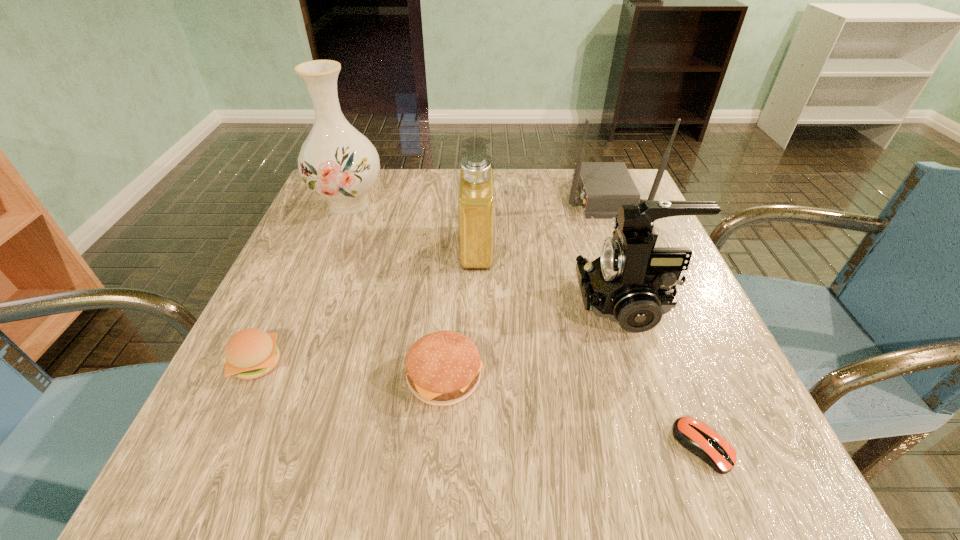
You are a GUI agent. You are given a task and a screenshot of the screen. Output one action in this format:
    pyautogui.click(x=<x>, y=<y>)
    Task: Click on the free space at the far edge of the desktop
    The image size is (960, 540).
    Given the screenshot: What is the action you would take?
    pyautogui.click(x=395, y=204)

Find the location of a particular element. vacant space at the near edge is located at coordinates (463, 447).

Locate an element on the screen. This screenshot has height=540, width=960. vacant space at the left edge of the desktop is located at coordinates (359, 222).

The image size is (960, 540). What are the coordinates of `free space at the right edge` in the screenshot? It's located at (721, 393).

The image size is (960, 540). I want to click on vacant space in between the shortest object and the right hamburger, so click(574, 412).

Locate an element on the screen. This screenshot has height=540, width=960. free space between the left hamburger and the tallest object is located at coordinates (303, 284).

What are the coordinates of `free space between the right hamburger and the left hamburger` in the screenshot? It's located at (351, 370).

You are a GUI agent. You are given a task and a screenshot of the screen. Output one action in this format:
    pyautogui.click(x=<x>, y=<y>)
    Task: Click on the free area in between the camcorder and the right hamburger
    
    Given the screenshot: What is the action you would take?
    pyautogui.click(x=537, y=340)

Locate an element on the screen. This screenshot has height=540, width=960. the closest object to the shortest object is located at coordinates (631, 282).

Locate which object ranks fourth in proximity to the right hamburger. Please provide its 2D coordinates. Your answer should be formatted as a tuple, i.e. [(x, y)], where the tuple contains the x and y coordinates of a point satisfying the conditions above.

[(694, 435)]